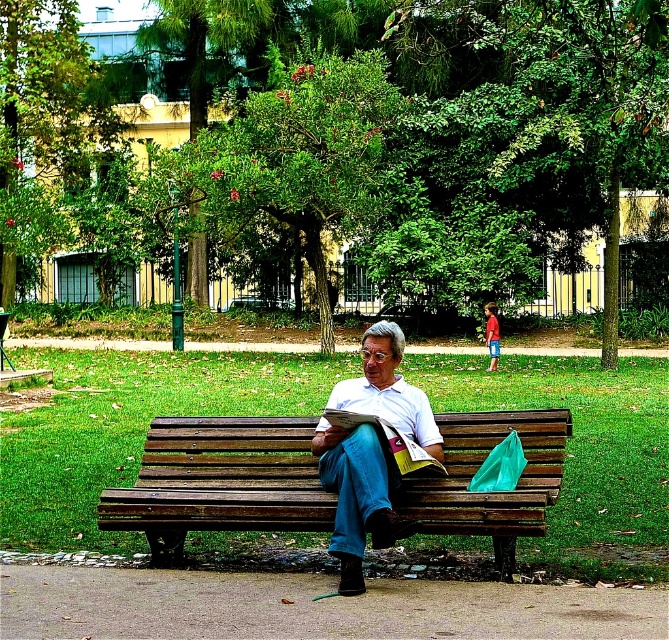
Consider the image. You are a park visitor who wants to pick up the white paper book at center. Since you are standing behind the wooden bench at center, can you reach it without moving the bench?

The white paper book at center is behind the wooden bench at center, so it is not visible or accessible from your current position behind the bench. You would need to move around the bench or the book to reach it.

You are a photographer planning to take a portrait of the man in the park. You want to ensure the matte white shirt at center is clearly visible in the photo. Given that the wooden bench at center is between you and the man, should you adjust your position forward or backward to achieve this?

Since the matte white shirt at center is behind the wooden bench at center, you should move forward to position yourself so that the wooden bench at center is no longer blocking the view of the matte white shirt at center.

You are a photographer trying to capture the man reading his book in the park. You want to ensure both the matte white shirt at center and the white paper book at center are clearly visible in your photo. Which object should you focus on first to ensure proper exposure, considering their size difference?

The matte white shirt at center has a larger size compared to the white paper book at center, so you should focus on the matte white shirt at center first to ensure proper exposure since it takes up more of the frame.